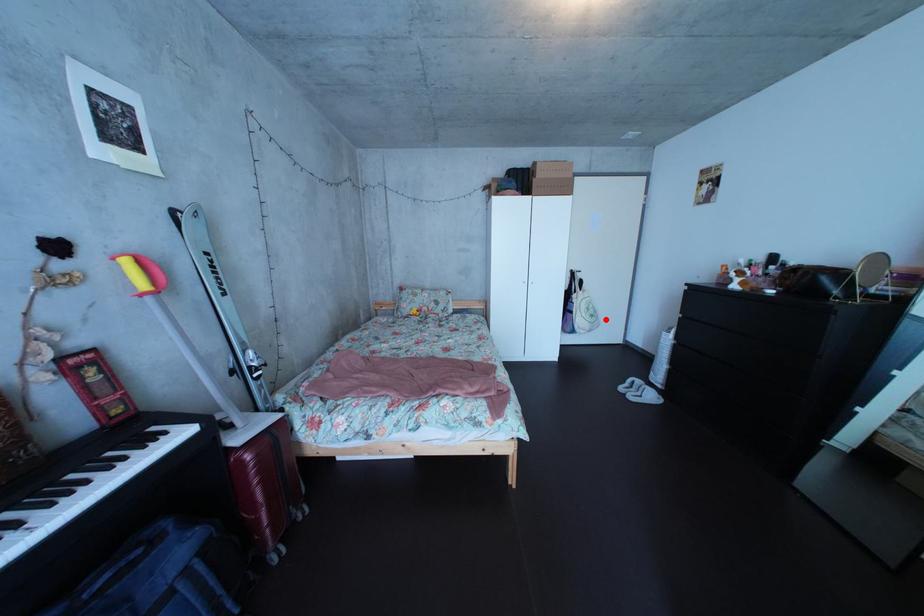
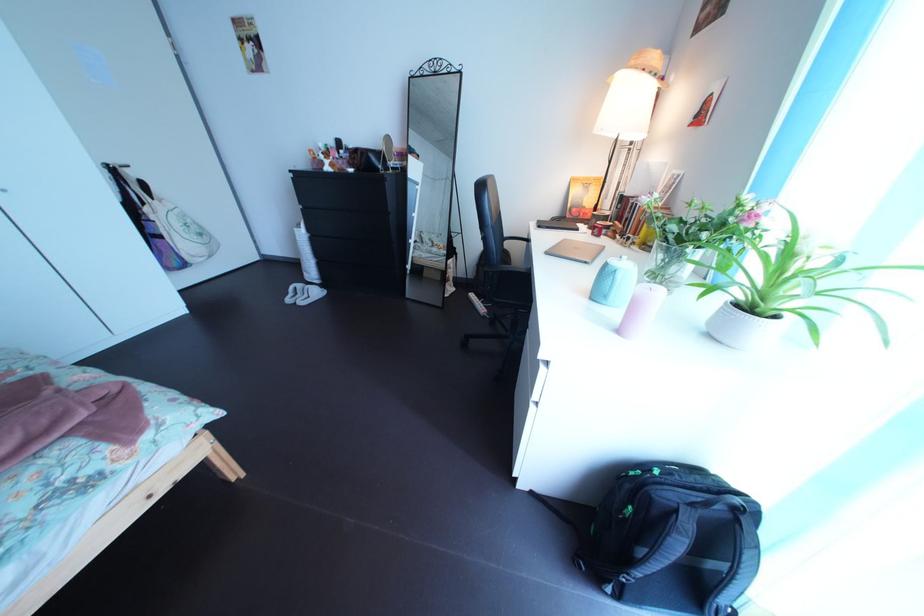
Question: I am providing you with two images of the same scene from different viewpoints. A red point is marked on the first image. Is the red point's position out of view in image 2?

Choices:
 (A) Yes
 (B) No

Answer: (B)